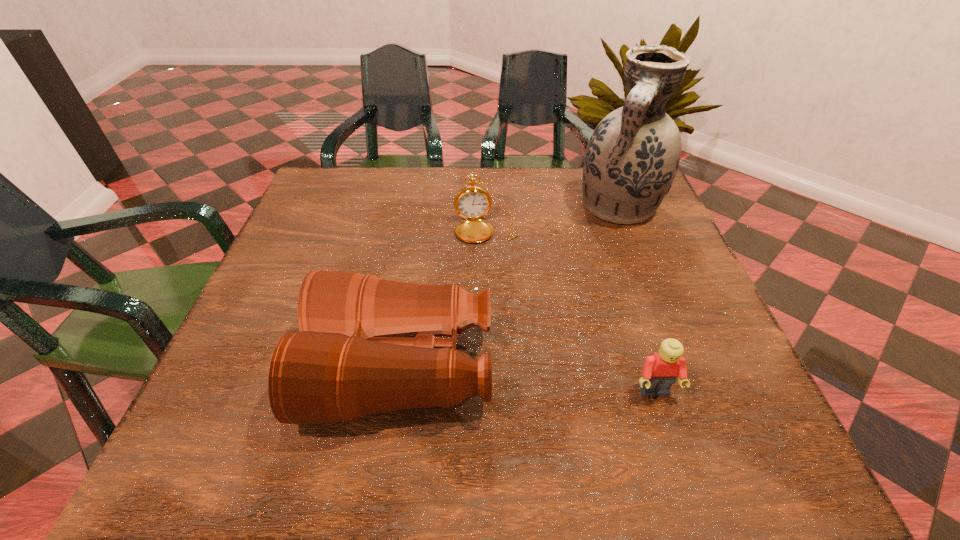
Where is `binoculars`? The image size is (960, 540). binoculars is located at coordinates (366, 345).

Locate an element on the screen. Image resolution: width=960 pixels, height=540 pixels. Lego is located at coordinates (660, 371).

Locate an element on the screen. pocket watch is located at coordinates (472, 202).

The height and width of the screenshot is (540, 960). Find the location of `vase`. vase is located at coordinates (632, 157).

The height and width of the screenshot is (540, 960). Find the location of `vacant area located 0.160m through the lenses of the binoculars`. vacant area located 0.160m through the lenses of the binoculars is located at coordinates (225, 368).

I want to click on free space located through the lenses of the binoculars, so click(269, 368).

Identify the location of vacant space situated 0.080m through the lenses of the binoculars. (269, 368).

This screenshot has width=960, height=540. Identify the location of blank space located on the face of the pocket watch. (500, 330).

I want to click on free region located on the face of the pocket watch, so click(x=499, y=322).

Identify the location of free space located on the face of the pocket watch. This screenshot has width=960, height=540. (494, 287).